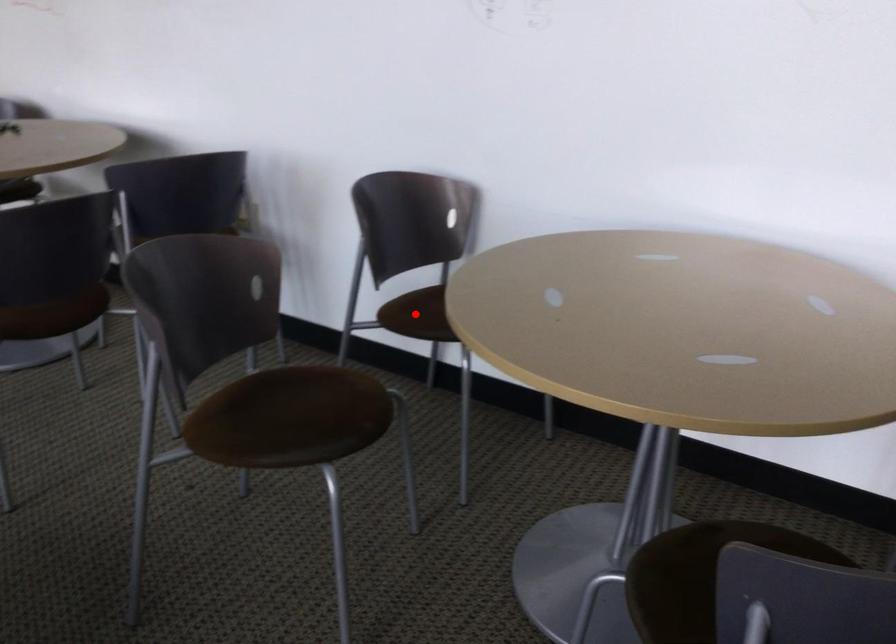
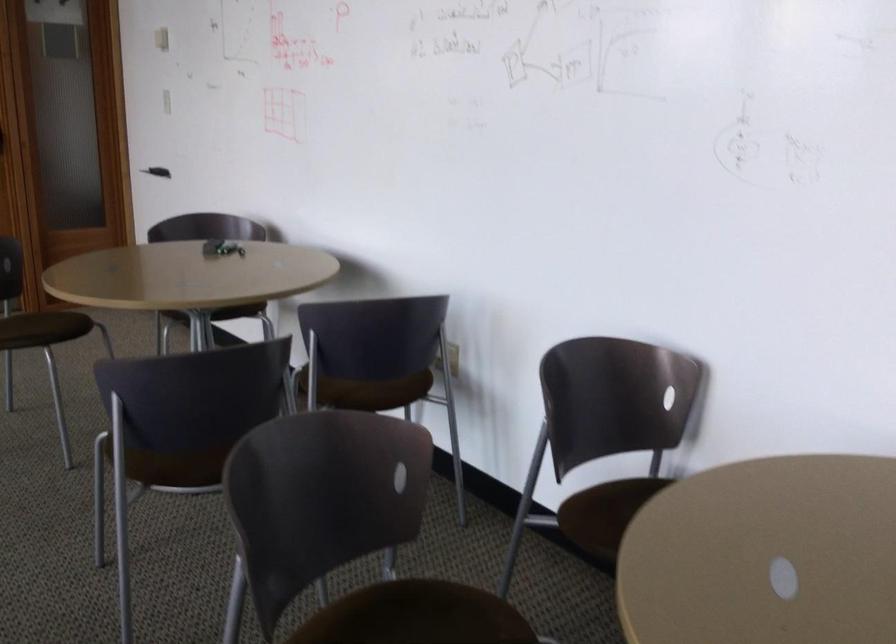
Question: I am providing you with two images of the same scene from different viewpoints. Image1 has a red point marked. In image2, the corresponding 3D location appears at what relative position? Reply with the corresponding letter.

Choices:
 (A) Closer
 (B) Farther

Answer: (A)